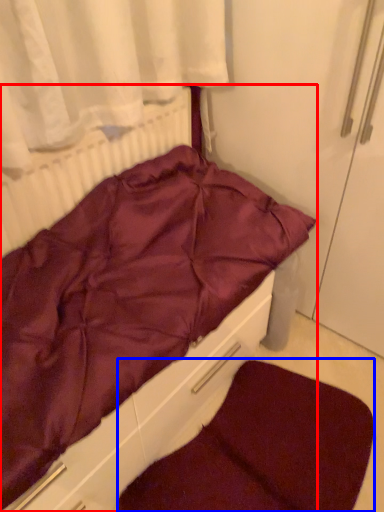
Question: Which object appears closest to the camera in this image, furniture (highlighted by a red box) or dog bed (highlighted by a blue box)?

Choices:
 (A) furniture
 (B) dog bed

Answer: (A)